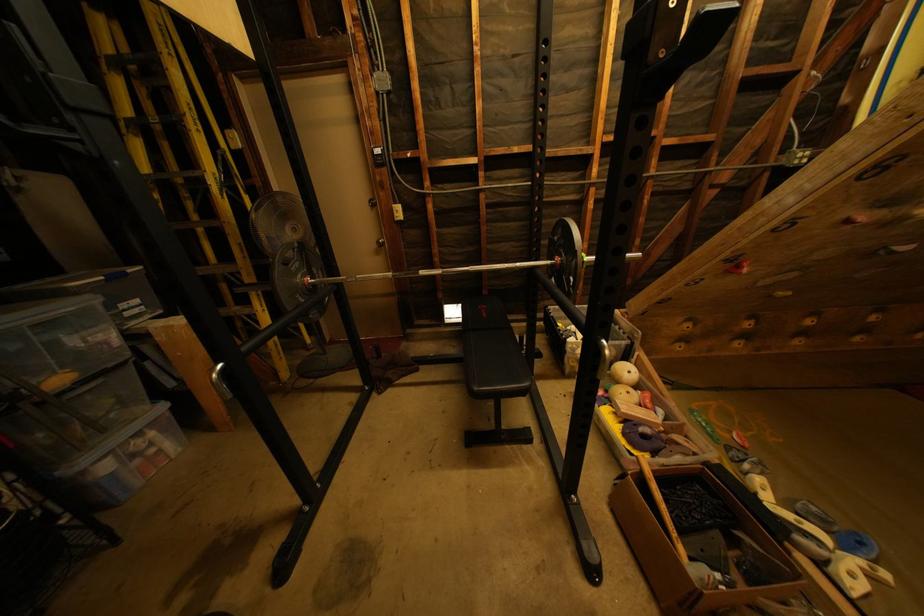
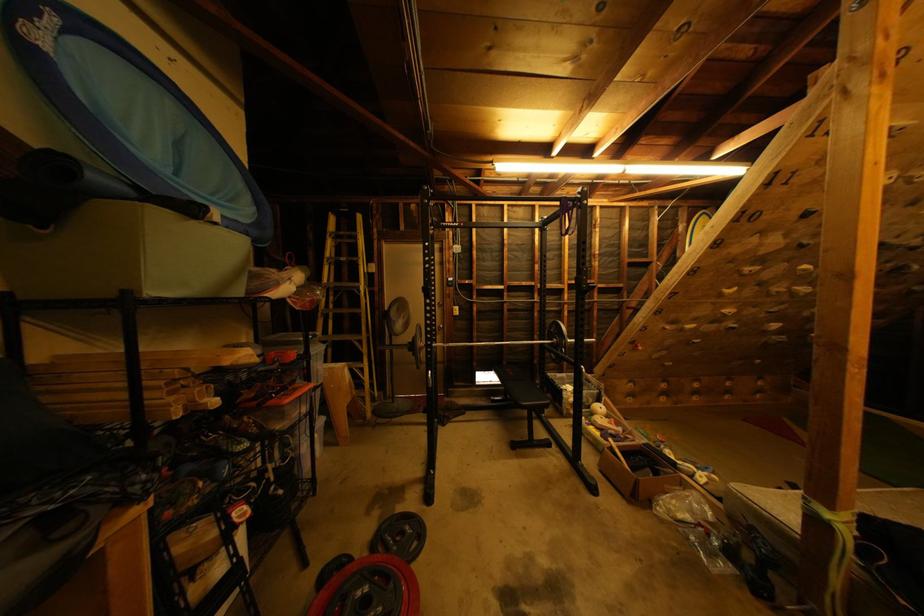
Which direction would the cameraman need to move to produce the second image?

The movement direction of the cameraman is left, backward.